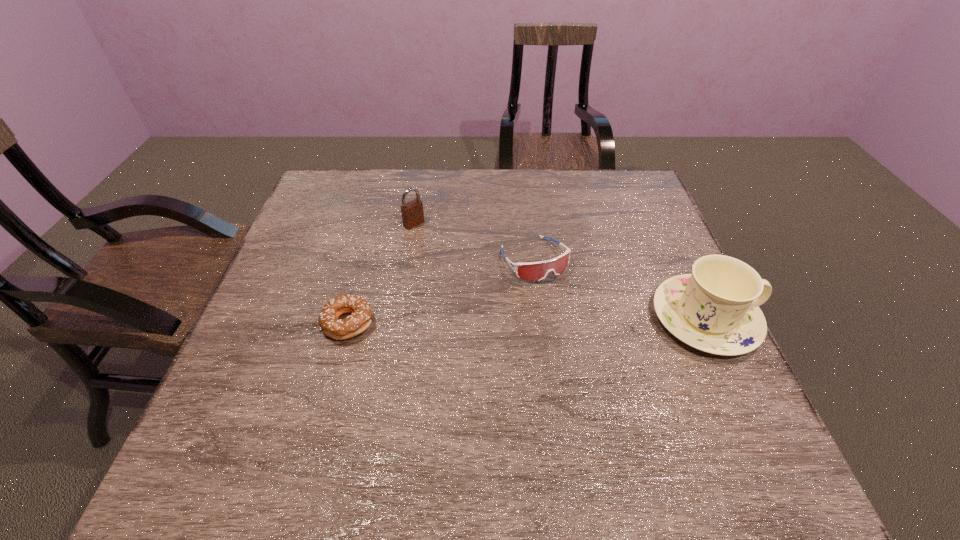
Identify the location of free location at the near left corner. (270, 407).

You are a GUI agent. You are given a task and a screenshot of the screen. Output one action in this format:
    pyautogui.click(x=<x>, y=<y>)
    Task: Click on the free space at the near right corner of the desktop
    
    Given the screenshot: What is the action you would take?
    pyautogui.click(x=723, y=395)

Find the location of a particular element. This screenshot has height=540, width=960. free area in between the farthest object and the second object from right to left is located at coordinates (474, 241).

Identify the location of blank region between the rightmost object and the shortest object. (527, 321).

This screenshot has width=960, height=540. I want to click on empty location between the leftmost object and the farthest object, so click(x=381, y=274).

You are a GUI agent. You are given a task and a screenshot of the screen. Output one action in this format:
    pyautogui.click(x=<x>, y=<y>)
    Task: Click on the vacant region between the leftmost object and the third object from left to right
    The image size is (960, 540).
    Given the screenshot: What is the action you would take?
    pyautogui.click(x=442, y=291)

Identify the location of empty space that is in between the doughnut and the rightmost object. The image size is (960, 540). (527, 321).

At what (x,y) coordinates should I click in order to perform the action: click on empty space between the third object from left to right and the padlock. Please return your answer as a coordinate pair (x, y). The width and height of the screenshot is (960, 540). Looking at the image, I should click on (474, 241).

This screenshot has width=960, height=540. I want to click on vacant region between the second object from left to right and the goggles, so click(474, 241).

Point out which object is positioned as the nearest to the doughnut. Please provide its 2D coordinates. Your answer should be formatted as a tuple, i.e. [(x, y)], where the tuple contains the x and y coordinates of a point satisfying the conditions above.

[(412, 212)]